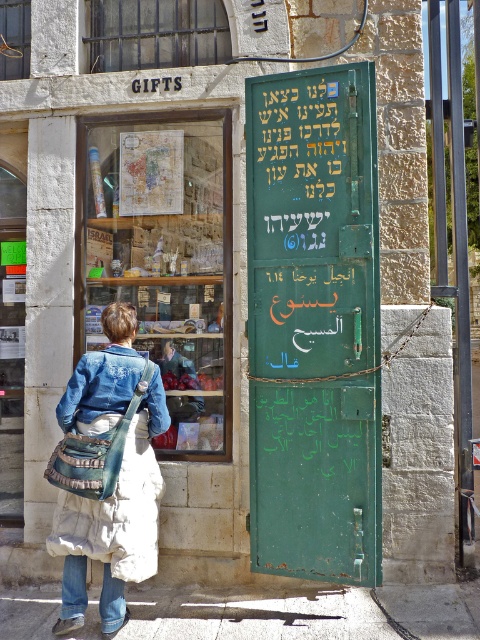
Is denim jacket at lower right to the right of denim jeans at lower left from the viewer's perspective?

Indeed, denim jacket at lower right is positioned on the right side of denim jeans at lower left.

The image size is (480, 640). Describe the element at coordinates (99, 385) in the screenshot. I see `denim jacket at lower right` at that location.

Locate an element on the screen. Image resolution: width=480 pixels, height=640 pixels. denim jacket at lower right is located at coordinates (99, 385).

The height and width of the screenshot is (640, 480). What do you see at coordinates (108, 474) in the screenshot? I see `denim jacket at lower left` at bounding box center [108, 474].

Can you confirm if denim jacket at lower left is thinner than denim jeans at lower left?

Incorrect, denim jacket at lower left's width is not less than denim jeans at lower left's.

Who is more distant from viewer, (144, 428) or (117, 616)?

The point (144, 428) is behind.

This screenshot has height=640, width=480. Find the location of `denim jacket at lower left`. denim jacket at lower left is located at coordinates (108, 474).

Can you confirm if green matte signboard at center is positioned below denim jacket at lower left?

No, green matte signboard at center is not below denim jacket at lower left.

Is point (373, 476) positioned in front of point (84, 531)?

Yes.

Locate an element on the screen. The image size is (480, 640). green matte signboard at center is located at coordinates click(x=313, y=323).